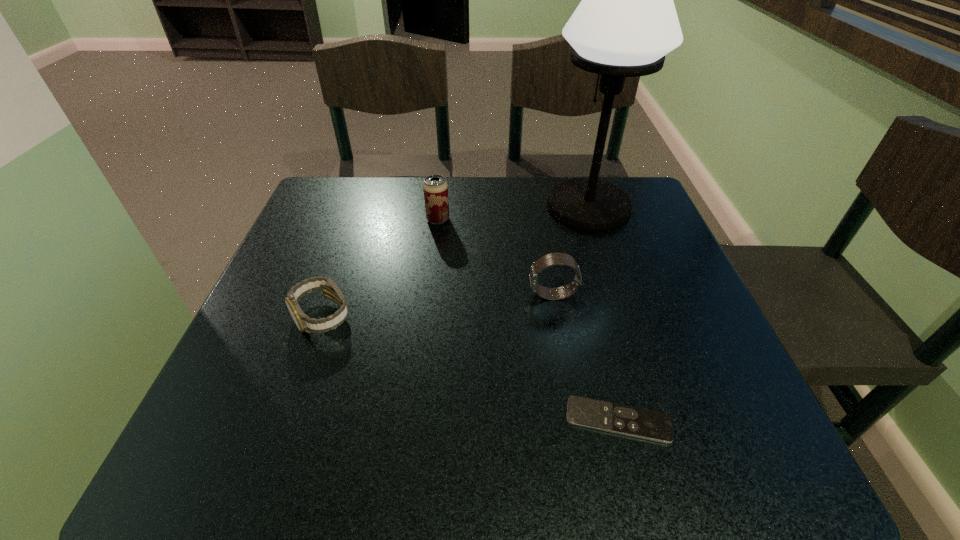
Where is `free space that satisfies the following two spatial constraints: 1. on the face of the taller watch; 2. on the face of the left watch`? The width and height of the screenshot is (960, 540). free space that satisfies the following two spatial constraints: 1. on the face of the taller watch; 2. on the face of the left watch is located at coordinates (557, 316).

Find the location of a particular element. This screenshot has height=540, width=960. vacant region that satisfies the following two spatial constraints: 1. on the face of the taller watch; 2. on the right side of the remote control is located at coordinates (574, 420).

I want to click on vacant position in the image that satisfies the following two spatial constraints: 1. on the face of the shorter watch; 2. on the left side of the shortest object, so click(286, 420).

Locate an element on the screen. The height and width of the screenshot is (540, 960). free point that satisfies the following two spatial constraints: 1. on the face of the shortest object; 2. on the left side of the taller watch is located at coordinates (574, 420).

Where is `vacant area that satisfies the following two spatial constraints: 1. on the face of the taller watch; 2. on the face of the second shortest object`? This screenshot has width=960, height=540. vacant area that satisfies the following two spatial constraints: 1. on the face of the taller watch; 2. on the face of the second shortest object is located at coordinates click(557, 316).

Locate an element on the screen. The image size is (960, 540). vacant region that satisfies the following two spatial constraints: 1. on the face of the remote control; 2. on the left side of the right watch is located at coordinates (574, 420).